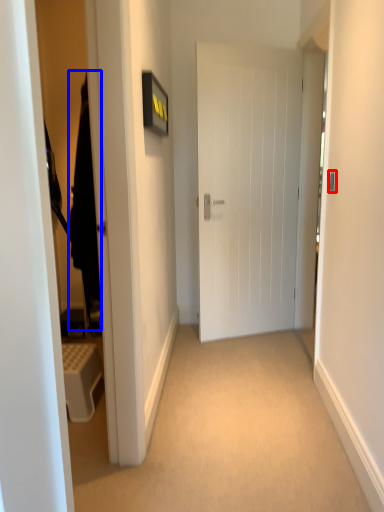
Question: Which object is closer to the camera taking this photo, door handle (highlighted by a red box) or robe (highlighted by a blue box)?

Choices:
 (A) door handle
 (B) robe

Answer: (B)